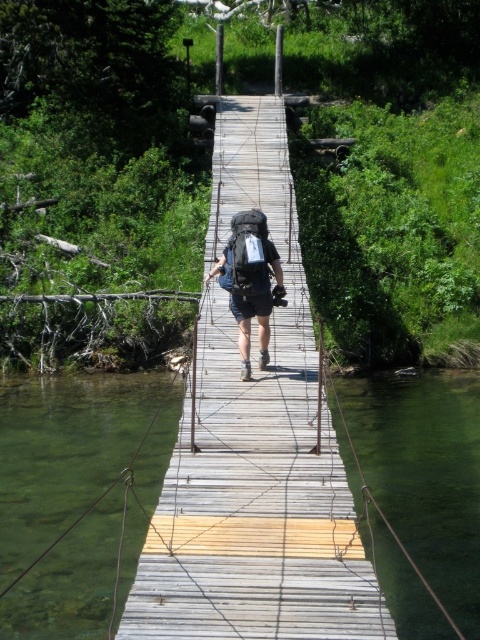
Question: Which point is closer to the camera?

Choices:
 (A) wooden bridge at center
 (B) matte black backpack at center

Answer: (A)

Question: Is wooden bridge at center above matte black backpack at center?

Choices:
 (A) yes
 (B) no

Answer: (A)

Question: Is wooden bridge at center wider than matte black backpack at center?

Choices:
 (A) yes
 (B) no

Answer: (A)

Question: Can you confirm if wooden bridge at center is positioned above matte black backpack at center?

Choices:
 (A) yes
 (B) no

Answer: (A)

Question: Which of the following is the closest to the observer?

Choices:
 (A) wooden bridge at center
 (B) matte black backpack at center

Answer: (A)